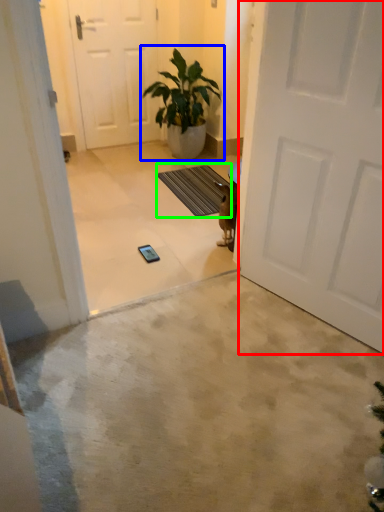
Question: Which is nearer to the door (highlighted by a red box)? houseplant (highlighted by a blue box) or doormat (highlighted by a green box).

Choices:
 (A) houseplant
 (B) doormat

Answer: (B)